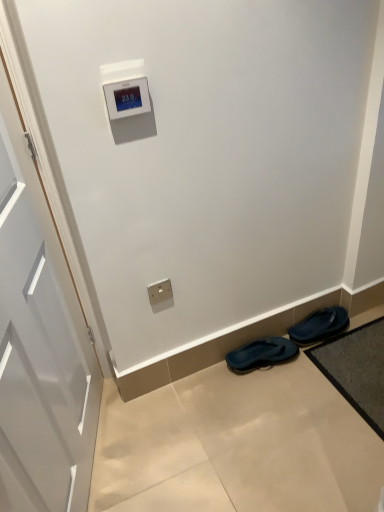
Locate an element on the screen. The image size is (384, 512). free space to the left of dark gray textured bath mat at lower right is located at coordinates (293, 415).